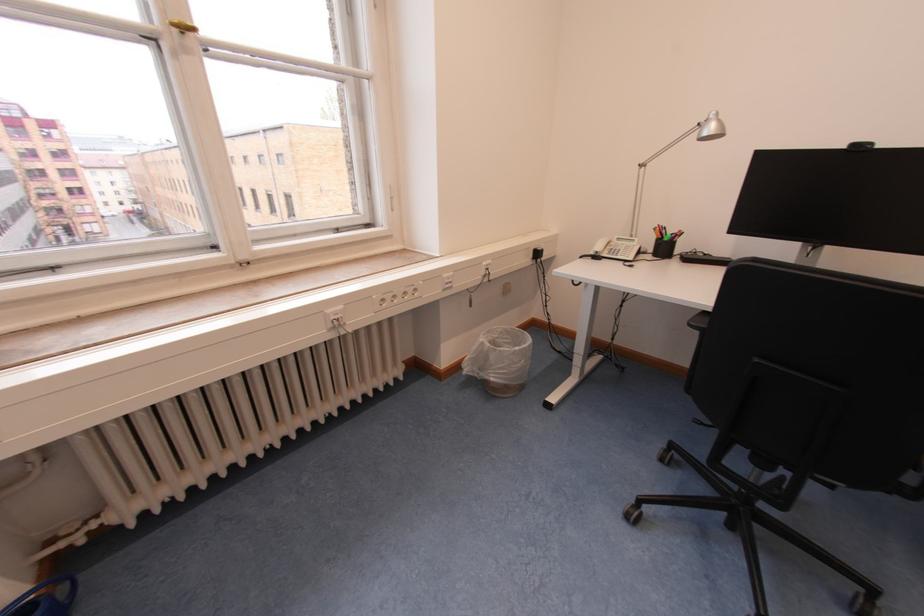
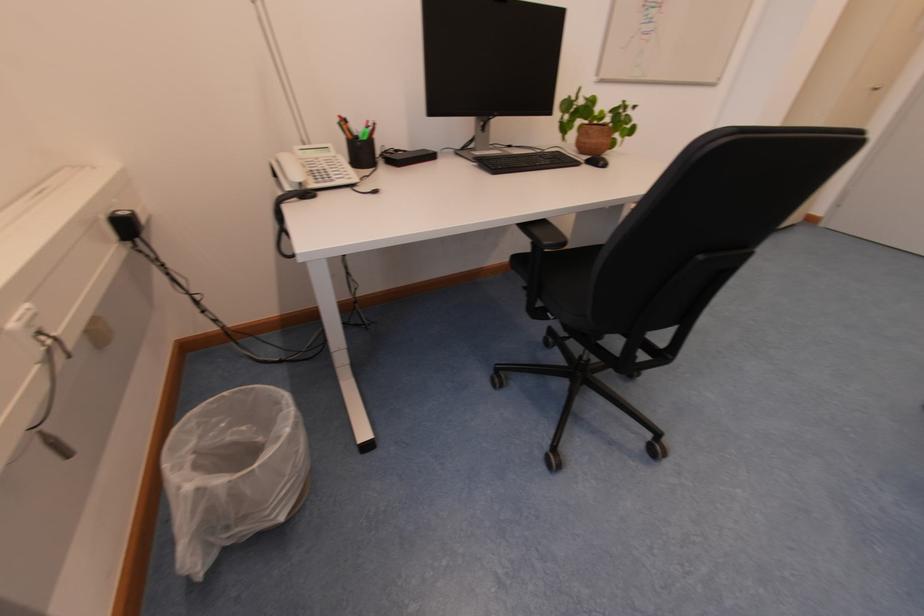
The point at (524, 353) is marked in the first image. Where is the corresponding point in the second image?

(296, 437)